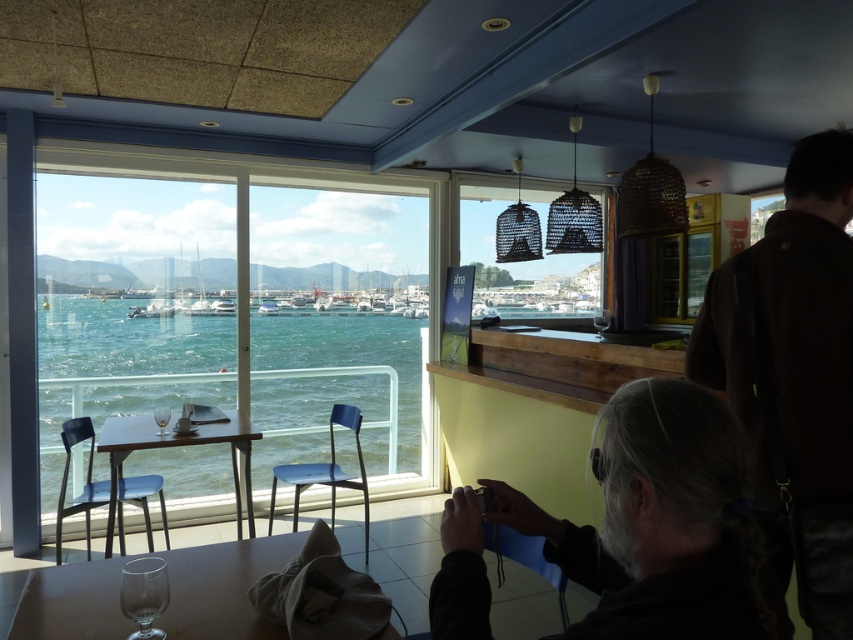
Who is higher up, dark brown leather jacket at upper right or transparent glass at right?

Positioned higher is transparent glass at right.

Is point (811, 540) less distant than point (602, 317)?

Yes.

Is point (795, 298) less distant than point (602, 330)?

Yes, point (795, 298) is closer to viewer.

At what (x,y) coordinates should I click in order to perform the action: click on dark brown leather jacket at upper right. Please return your answer as a coordinate pair (x, y). The width and height of the screenshot is (853, 640). Looking at the image, I should click on (795, 369).

Describe the element at coordinates (665, 525) in the screenshot. This screenshot has height=640, width=853. I see `gray hair at center` at that location.

Can you confirm if gray hair at center is shorter than dark wood table at lower left?

Indeed, gray hair at center has a lesser height compared to dark wood table at lower left.

What are the coordinates of `gray hair at center` in the screenshot? It's located at (665, 525).

Is woven wood lanterns at center smaller than transparent glass at right?

No, woven wood lanterns at center is not smaller than transparent glass at right.

The image size is (853, 640). Identify the location of woven wood lanterns at center. click(523, 262).